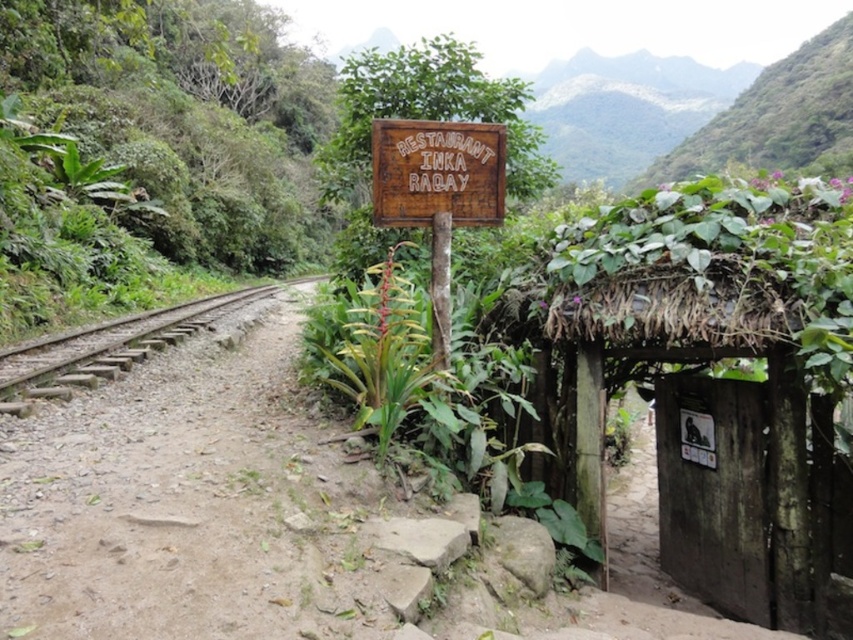
From the picture: Who is shorter, wooden sign at center or brown wooden train track at left?

wooden sign at center

Is wooden sign at center positioned before brown wooden train track at left?

Yes, it is in front of brown wooden train track at left.

Between point (376, 192) and point (32, 374), which one is positioned behind?

The point (32, 374) is behind.

At what (x,y) coordinates should I click in order to perform the action: click on wooden sign at center. Please return your answer as a coordinate pair (x, y). This screenshot has width=853, height=640. Looking at the image, I should click on coord(437,172).

Does wooden thatched hut at right appear on the right side of wooden sign at center?

Correct, you'll find wooden thatched hut at right to the right of wooden sign at center.

This screenshot has width=853, height=640. Describe the element at coordinates (714, 378) in the screenshot. I see `wooden thatched hut at right` at that location.

Does point (773, 241) come farther from viewer compared to point (409, 196)?

No, it is not.

Find the location of a particular element. wooden thatched hut at right is located at coordinates (714, 378).

Does brown gravel dirt track at left have a lesser height compared to brown wooden train track at left?

Indeed, brown gravel dirt track at left has a lesser height compared to brown wooden train track at left.

Is brown gravel dirt track at left smaller than brown wooden train track at left?

Indeed, brown gravel dirt track at left has a smaller size compared to brown wooden train track at left.

Is point (152, 513) less distant than point (15, 401)?

Yes, point (152, 513) is closer to viewer.

The image size is (853, 640). I want to click on brown gravel dirt track at left, so click(160, 493).